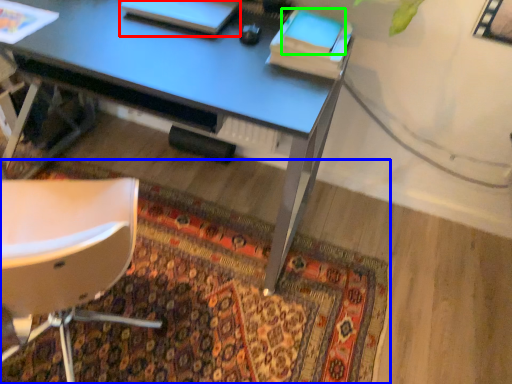
Question: Based on their relative distances, which object is nearer to book (highlighted by a red box)? Choose from mat (highlighted by a blue box) and notepad (highlighted by a green box).

Choices:
 (A) mat
 (B) notepad

Answer: (B)